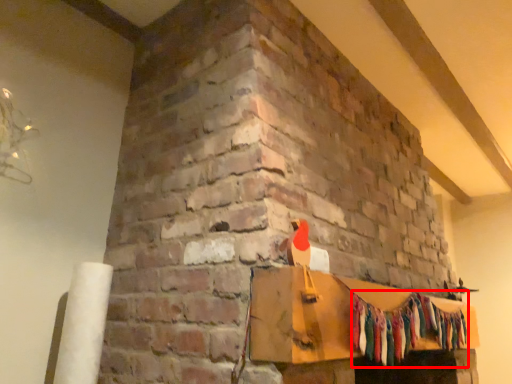
Question: From the image's perspective, considering the relative positions of clothing (annotated by the red box) and furniture in the image provided, where is clothing (annotated by the red box) located with respect to the staircase?

Choices:
 (A) below
 (B) above

Answer: (A)